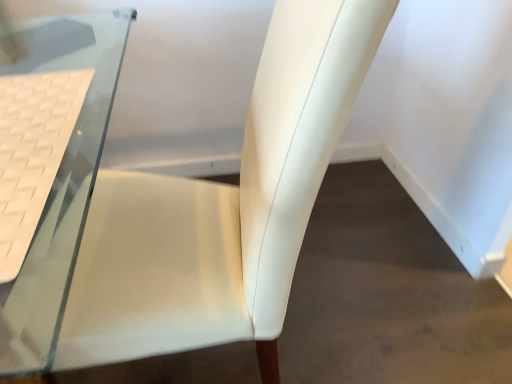
The image size is (512, 384). What do you see at coordinates (32, 152) in the screenshot?
I see `white matte keyboard at left` at bounding box center [32, 152].

The height and width of the screenshot is (384, 512). What are the coordinates of `white matte keyboard at left` in the screenshot? It's located at (32, 152).

This screenshot has width=512, height=384. Find the location of `white matte keyboard at left`. white matte keyboard at left is located at coordinates (32, 152).